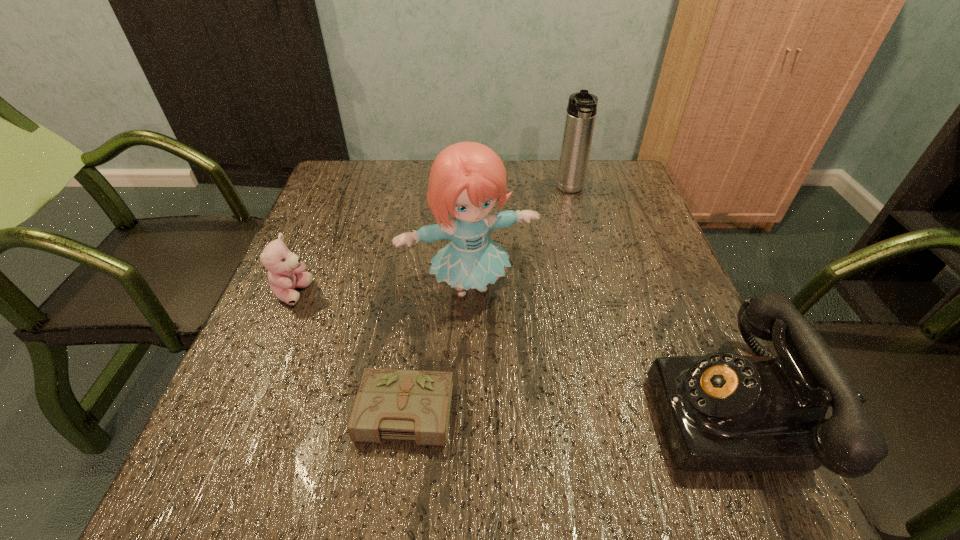
Where is `free space on the desktop that is between the diary and the rightmost object and is positioned on the front-facing side of the tallest object`? This screenshot has height=540, width=960. free space on the desktop that is between the diary and the rightmost object and is positioned on the front-facing side of the tallest object is located at coordinates [521, 411].

Where is `vacant space on the desktop that is between the shortest object and the rightmost object and is positioned on the handle side of the thermos bottle`? The height and width of the screenshot is (540, 960). vacant space on the desktop that is between the shortest object and the rightmost object and is positioned on the handle side of the thermos bottle is located at coordinates (601, 411).

This screenshot has width=960, height=540. Find the location of `vacant space on the desktop that is between the shortest object and the rightmost object and is positioned at the face of the leftmost object`. vacant space on the desktop that is between the shortest object and the rightmost object and is positioned at the face of the leftmost object is located at coordinates (516, 411).